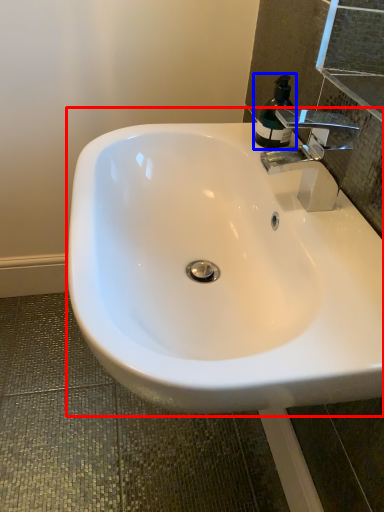
Question: Which point is closer to the camera, sink (highlighted by a red box) or soap dispenser (highlighted by a blue box)?

Choices:
 (A) sink
 (B) soap dispenser

Answer: (A)